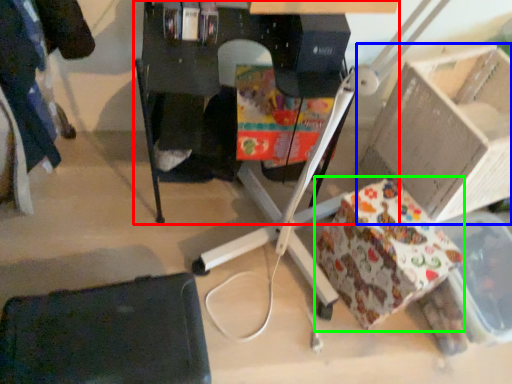
Question: Based on their relative distances, which object is farther from furniture (highlighted by a red box)? Choose from cardboard box (highlighted by a blue box) and wrapping paper (highlighted by a green box).

Choices:
 (A) cardboard box
 (B) wrapping paper

Answer: (B)